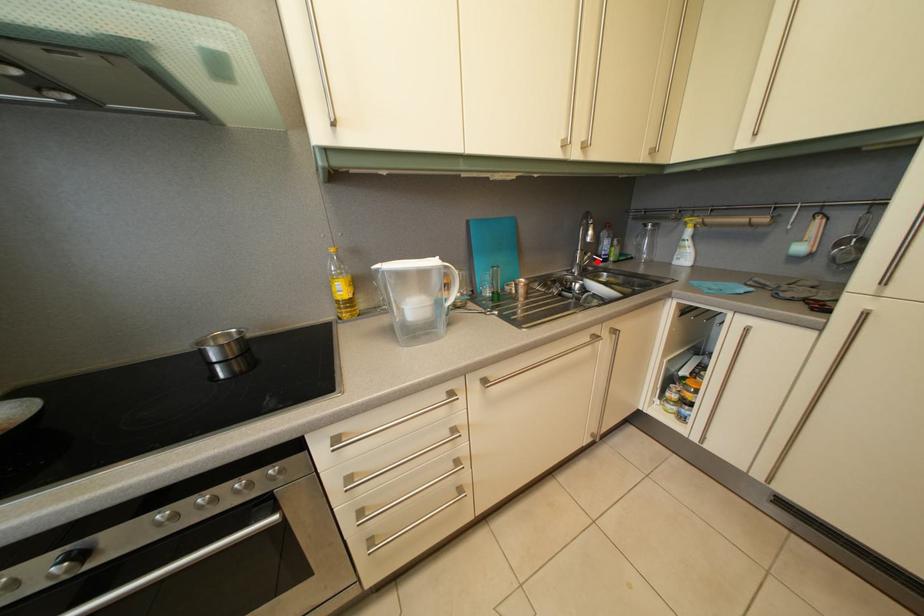
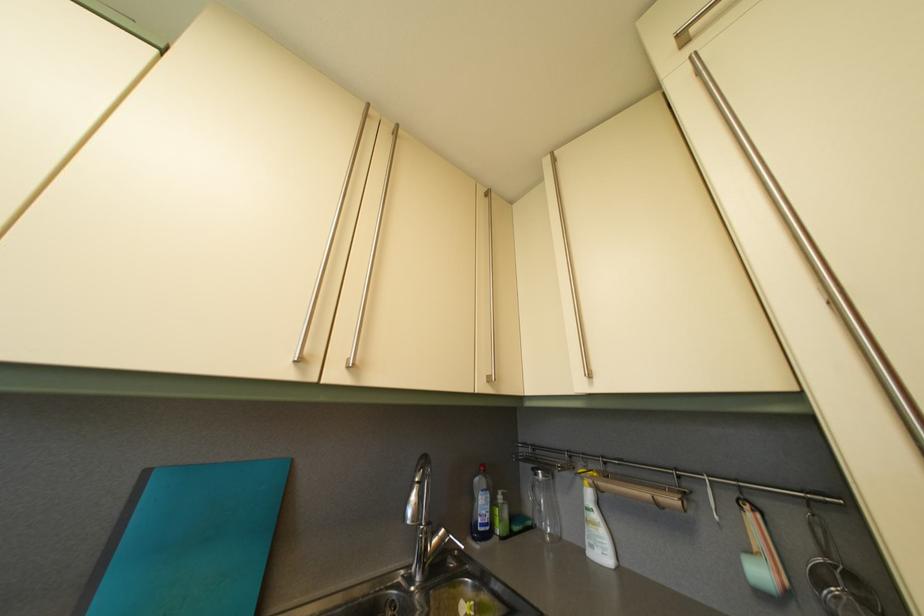
Where in the second image is the point corresponding to the highlighted location from the first image?

(451, 539)